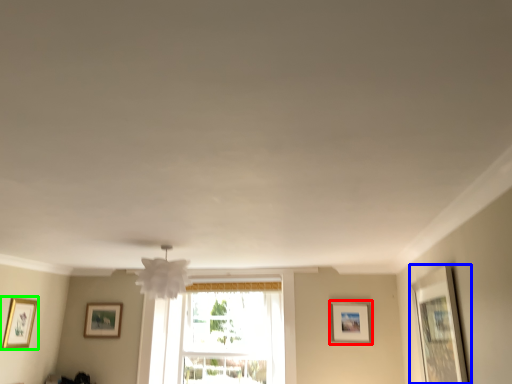
Question: Considering the real-world distances, which object is closest to picture frame (highlighted by a red box)? picture frame (highlighted by a blue box) or picture frame (highlighted by a green box).

Choices:
 (A) picture frame
 (B) picture frame

Answer: (A)